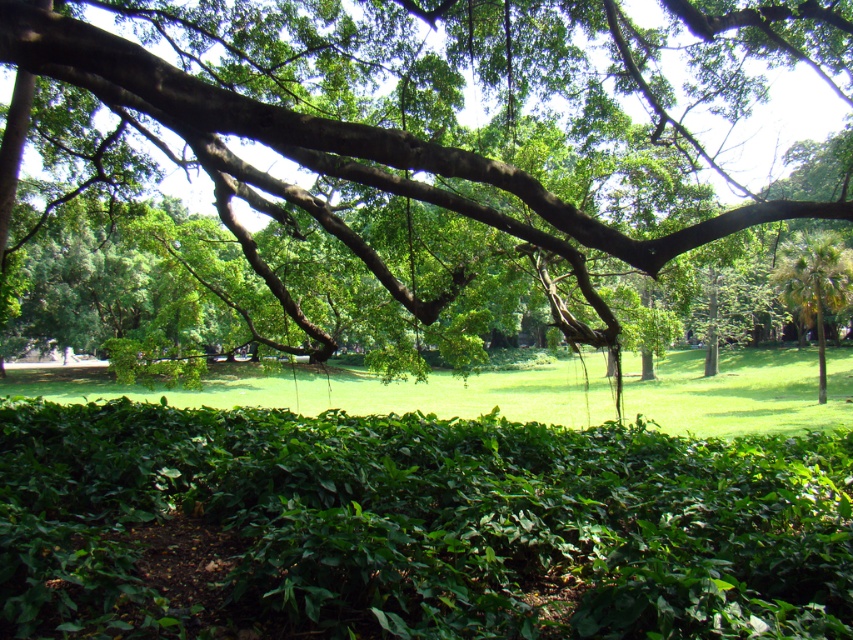
Does green leafy tree at upper center have a greater height compared to green grassy at center?

Indeed, green leafy tree at upper center has a greater height compared to green grassy at center.

Is green leafy tree at upper center thinner than green grassy at center?

Yes, green leafy tree at upper center is thinner than green grassy at center.

Image resolution: width=853 pixels, height=640 pixels. What do you see at coordinates (416, 124) in the screenshot?
I see `green leafy tree at upper center` at bounding box center [416, 124].

You are a GUI agent. You are given a task and a screenshot of the screen. Output one action in this format:
    pyautogui.click(x=<x>, y=<y>)
    Task: Click on the green leafy tree at upper center
    Image resolution: width=853 pixels, height=640 pixels.
    Given the screenshot: What is the action you would take?
    pyautogui.click(x=416, y=124)

Describe the element at coordinates (432, 502) in the screenshot. Image resolution: width=853 pixels, height=640 pixels. I see `green leafy bush at center` at that location.

Is green leafy bush at center shorter than green leafy palm at right?

Yes.

The height and width of the screenshot is (640, 853). Describe the element at coordinates (432, 502) in the screenshot. I see `green leafy bush at center` at that location.

Find the location of a particular element. green leafy bush at center is located at coordinates (432, 502).

Does green leafy bush at center have a lesser width compared to green grassy at center?

Correct, green leafy bush at center's width is less than green grassy at center's.

Is green leafy bush at center below green grassy at center?

Actually, green leafy bush at center is above green grassy at center.

Which is in front, point (508, 420) or point (343, 381)?

Point (508, 420)

In order to click on green leafy bush at center in this screenshot , I will do `click(432, 502)`.